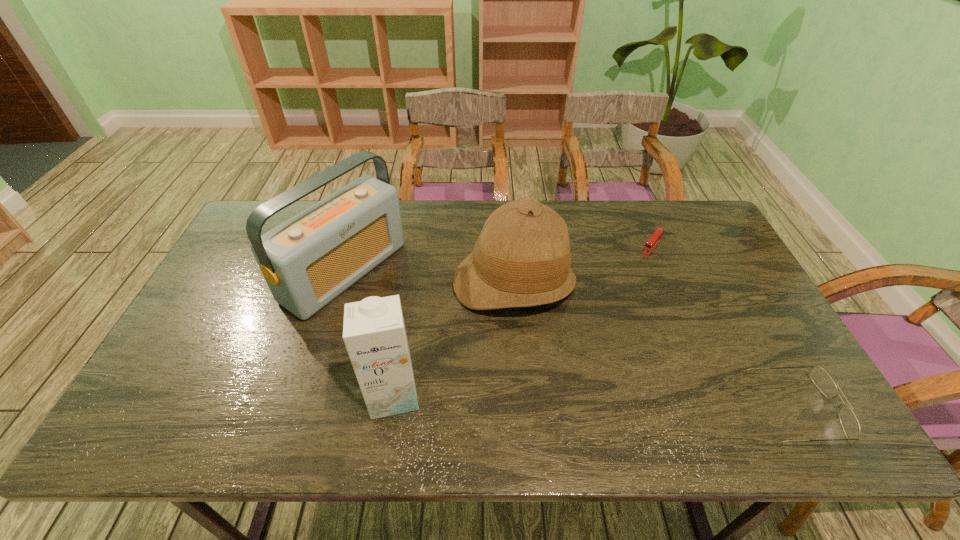
The image size is (960, 540). Identify the location of vacant space on the desktop that is between the carton and the rightmost object and is positioned on the front-facing side of the fourth object from left to right. (534, 399).

Locate an element on the screen. The image size is (960, 540). vacant space on the desktop that is between the carton and the spectacles and is positioned on the front-facing side of the third object from right to left is located at coordinates (540, 400).

Find the location of `vacant space on the desktop that is between the carton and the spectacles and is positioned on the front-facing side of the radio receiver`. vacant space on the desktop that is between the carton and the spectacles and is positioned on the front-facing side of the radio receiver is located at coordinates (555, 400).